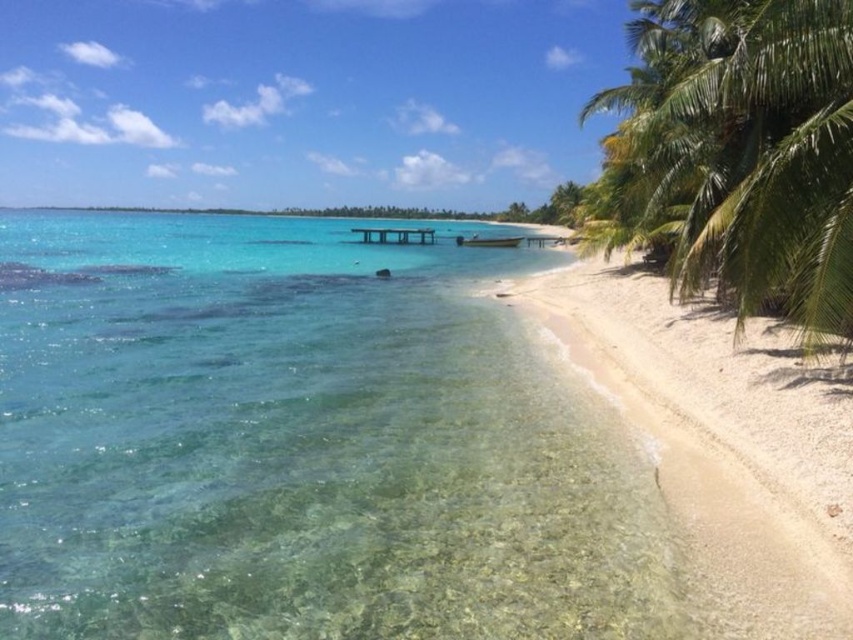
Is clear glassy water at center to the right of green leafy palm tree at right from the viewer's perspective?

No, clear glassy water at center is not to the right of green leafy palm tree at right.

Between clear glassy water at center and green leafy palm tree at right, which one appears on the left side from the viewer's perspective?

clear glassy water at center

Between point (129, 522) and point (788, 145), which one is positioned behind?

The point (788, 145) is behind.

I want to click on clear glassy water at center, so click(299, 444).